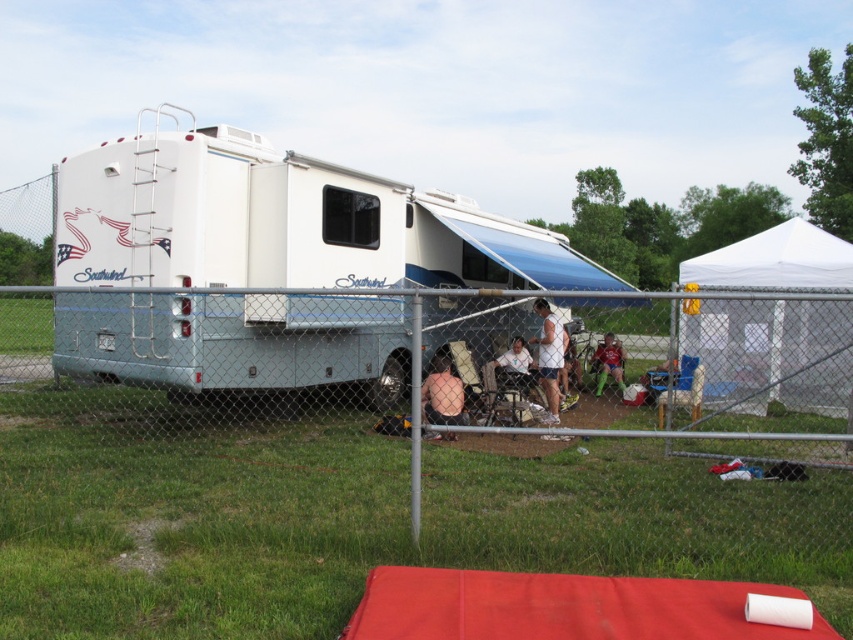
What do you see at coordinates (244, 378) in the screenshot?
I see `metal chain-link fence at center` at bounding box center [244, 378].

Between metal chain-link fence at center and white fabric shirt at center, which one is positioned higher?

Positioned higher is metal chain-link fence at center.

Who is more forward, [18,404] or [550,353]?

Point [550,353]

Image resolution: width=853 pixels, height=640 pixels. I want to click on metal chain-link fence at center, so click(244, 378).

I want to click on metal chain-link fence at center, so click(244, 378).

Can you confirm if metal chain-link fence at center is shorter than green mesh shorts at center?

No.

Is point (320, 323) less distant than point (608, 340)?

Yes, point (320, 323) is in front of point (608, 340).

Identify the location of metal chain-link fence at center. The width and height of the screenshot is (853, 640). (244, 378).

Is white glossy recreational vehicle at center thinner than smooth skin at center?

In fact, white glossy recreational vehicle at center might be wider than smooth skin at center.

Is white glossy recreational vehicle at center bigger than smooth skin at center?

Yes, white glossy recreational vehicle at center is bigger than smooth skin at center.

Between point (294, 170) and point (450, 394), which one is positioned in front?

Positioned in front is point (294, 170).

Locate an element on the screen. The height and width of the screenshot is (640, 853). white glossy recreational vehicle at center is located at coordinates tap(268, 264).